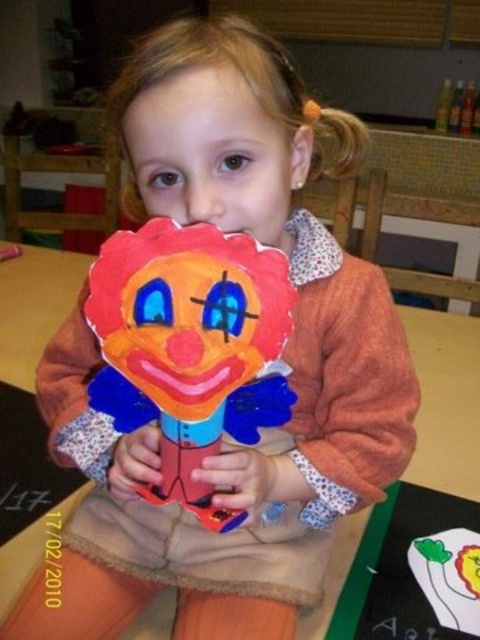
Which is more to the right, matte paper clown at center or matte plastic clown at center?

matte paper clown at center

The width and height of the screenshot is (480, 640). I want to click on matte paper clown at center, so click(x=190, y=346).

Between matte paper clown at center and matte paper hand at center, which one appears on the right side from the viewer's perspective?

From the viewer's perspective, matte paper hand at center appears more on the right side.

Does matte paper clown at center have a larger size compared to matte paper hand at center?

Indeed, matte paper clown at center has a larger size compared to matte paper hand at center.

What do you see at coordinates (190, 346) in the screenshot?
I see `matte paper clown at center` at bounding box center [190, 346].

Locate an element on the screen. This screenshot has height=640, width=480. matte paper clown at center is located at coordinates (190, 346).

Can you confirm if matte paper hand at center is positioned to the left of matte plastic clown at center?

No, matte paper hand at center is not to the left of matte plastic clown at center.

Is point (253, 476) behind point (132, 440)?

That is False.

Find the location of a particular element. The height and width of the screenshot is (640, 480). matte paper hand at center is located at coordinates [x=240, y=477].